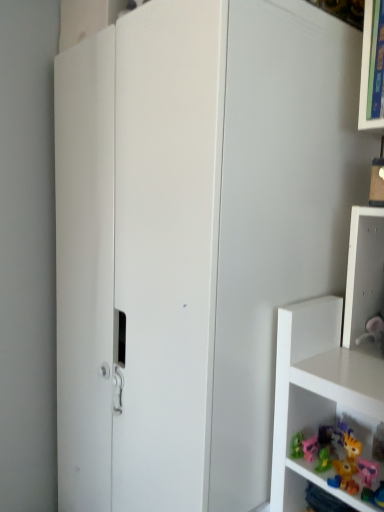
Question: Do you think pink plastic toy at lower right is within white plastic shelf at right, or outside of it?

Choices:
 (A) inside
 (B) outside

Answer: (B)

Question: Based on their positions, is pink plastic toy at lower right located to the left or right of white plastic shelf at right?

Choices:
 (A) left
 (B) right

Answer: (A)

Question: In terms of size, does pink plastic toy at lower right appear bigger or smaller than white plastic shelf at right?

Choices:
 (A) big
 (B) small

Answer: (B)

Question: Which is correct: white plastic shelf at right is inside pink plastic toy at lower right, or outside of it?

Choices:
 (A) outside
 (B) inside

Answer: (A)

Question: In terms of height, does white plastic shelf at right look taller or shorter compared to pink plastic toy at lower right?

Choices:
 (A) short
 (B) tall

Answer: (B)

Question: In terms of width, does white plastic shelf at right look wider or thinner when compared to pink plastic toy at lower right?

Choices:
 (A) wide
 (B) thin

Answer: (A)

Question: From a real-world perspective, is white plastic shelf at right above or below pink plastic toy at lower right?

Choices:
 (A) below
 (B) above

Answer: (B)